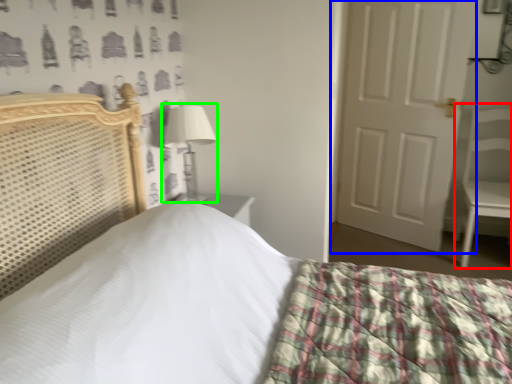
Question: Which object is positioned farthest from armchair (highlighted by a red box)? Select from door (highlighted by a blue box) and table lamp (highlighted by a green box).

Choices:
 (A) door
 (B) table lamp

Answer: (B)